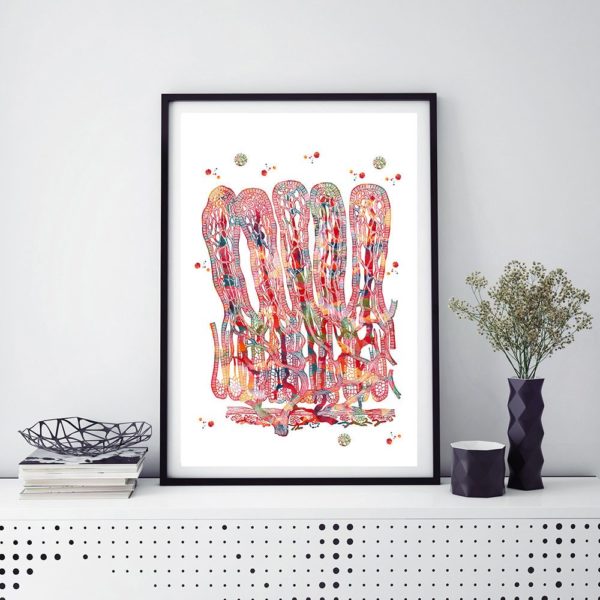
In order to click on vase in this screenshot , I will do coord(527,407).